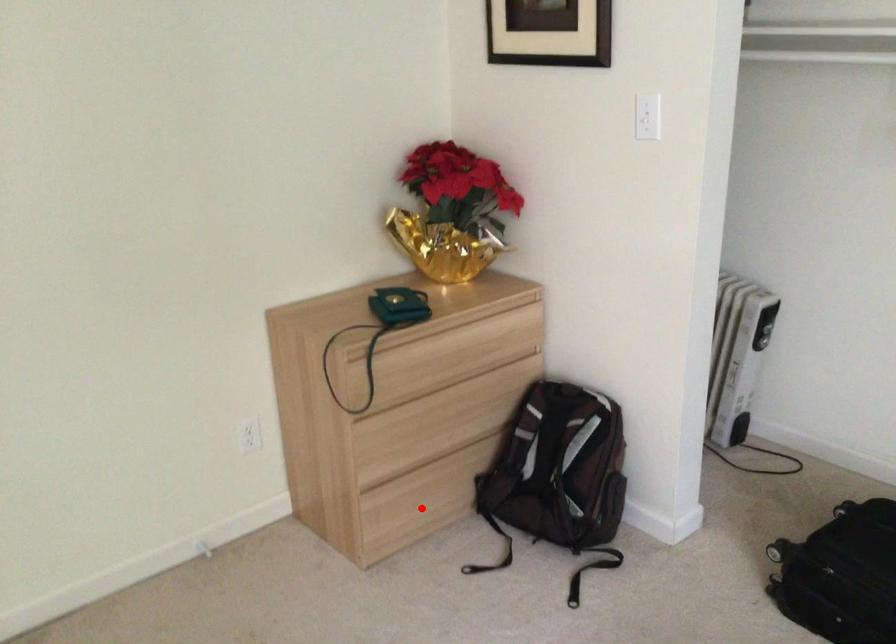
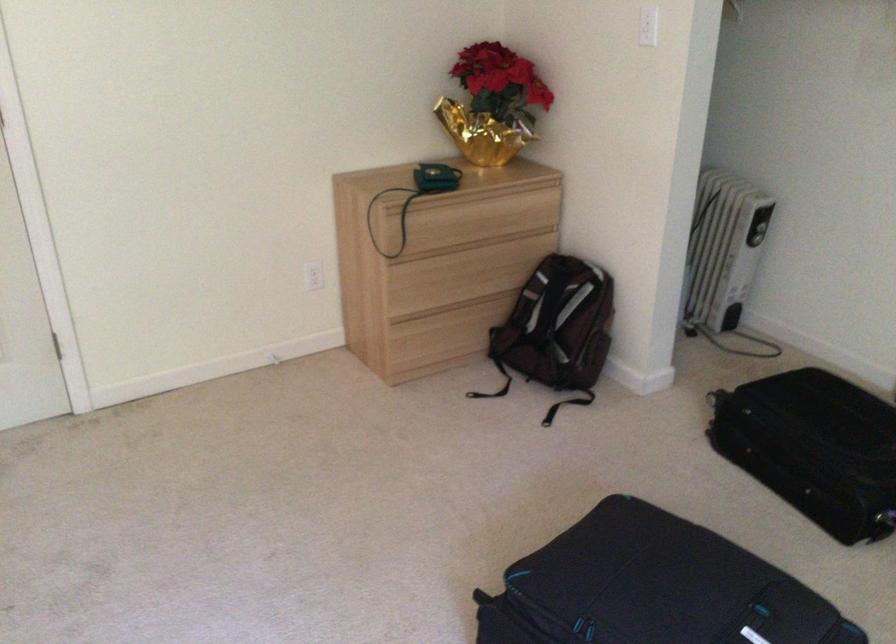
The point at the highlighted location is marked in the first image. Where is the corresponding point in the second image?

(442, 345)